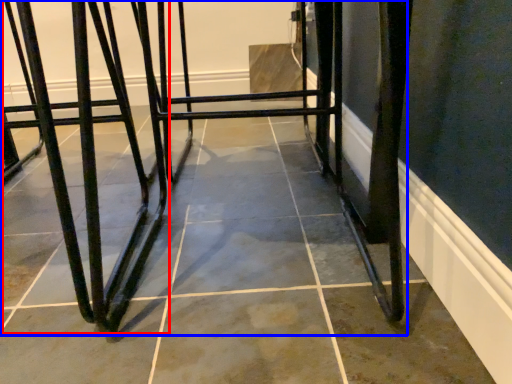
Question: Which object is closer to the camera taking this photo, bar stool (highlighted by a red box) or furniture (highlighted by a blue box)?

Choices:
 (A) bar stool
 (B) furniture

Answer: (B)